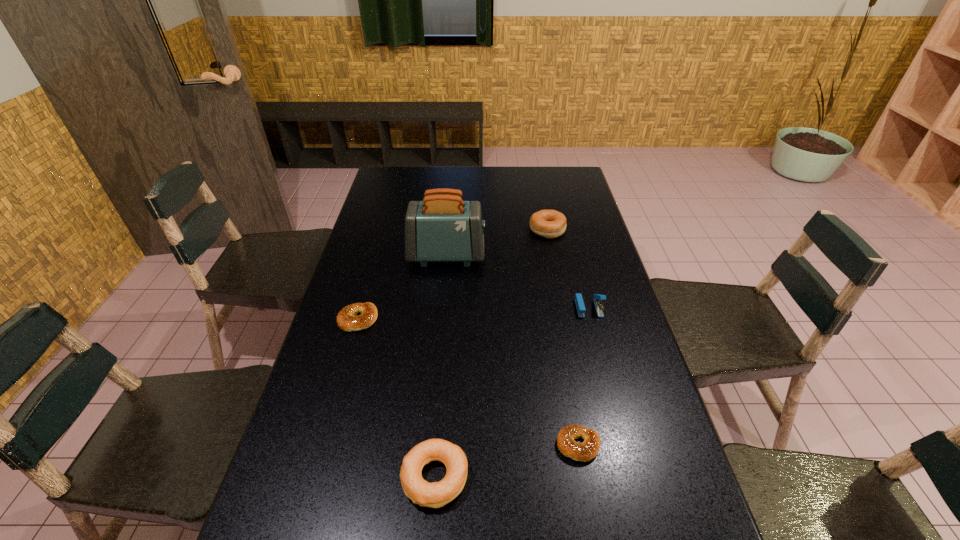
This screenshot has height=540, width=960. Identify the location of free space at the left edge of the desktop. (383, 245).

The image size is (960, 540). I want to click on vacant space at the right edge of the desktop, so click(x=556, y=198).

This screenshot has width=960, height=540. What are the coordinates of `blank region between the farthest bagel and the third tallest bagel` in the screenshot? It's located at (453, 274).

Find the location of a particular element. This screenshot has width=960, height=540. vacant area between the second shortest object and the shortest object is located at coordinates (468, 382).

What are the coordinates of `vacant area that lies between the shortest bagel and the third shortest bagel` in the screenshot? It's located at (507, 461).

Image resolution: width=960 pixels, height=540 pixels. What are the coordinates of `blank region between the tallest object and the third shortest bagel` in the screenshot? It's located at [x=441, y=366].

I want to click on unoccupied area between the toaster and the tallest bagel, so click(497, 243).

This screenshot has height=540, width=960. In order to click on vacant space that is in between the farthest bagel and the tallest object in this screenshot , I will do tap(497, 243).

What are the coordinates of `vacant area that lies between the second shortest object and the shortest bagel` in the screenshot? It's located at (468, 382).

This screenshot has height=540, width=960. In order to click on free space that is in between the tallest object and the second farthest bagel in this screenshot , I will do `click(402, 287)`.